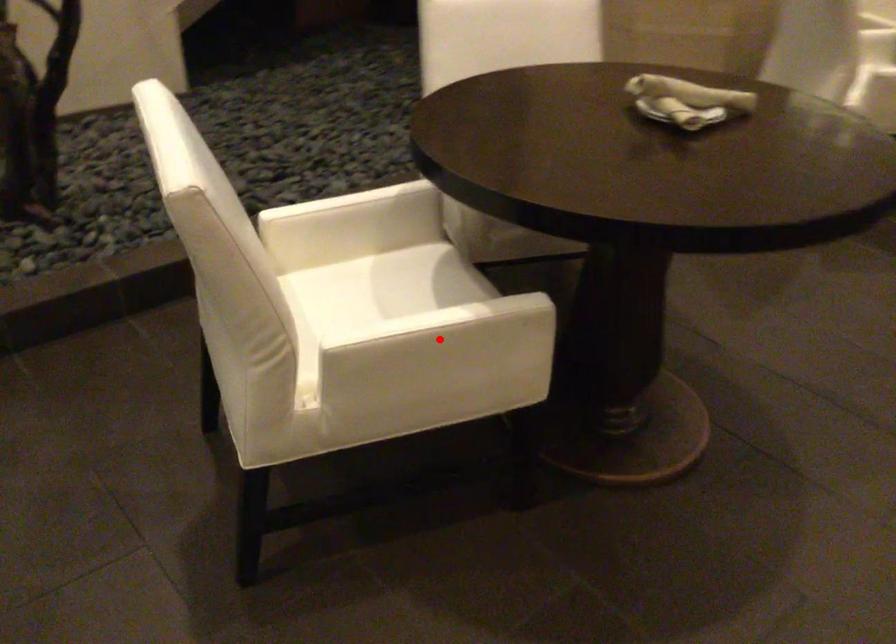
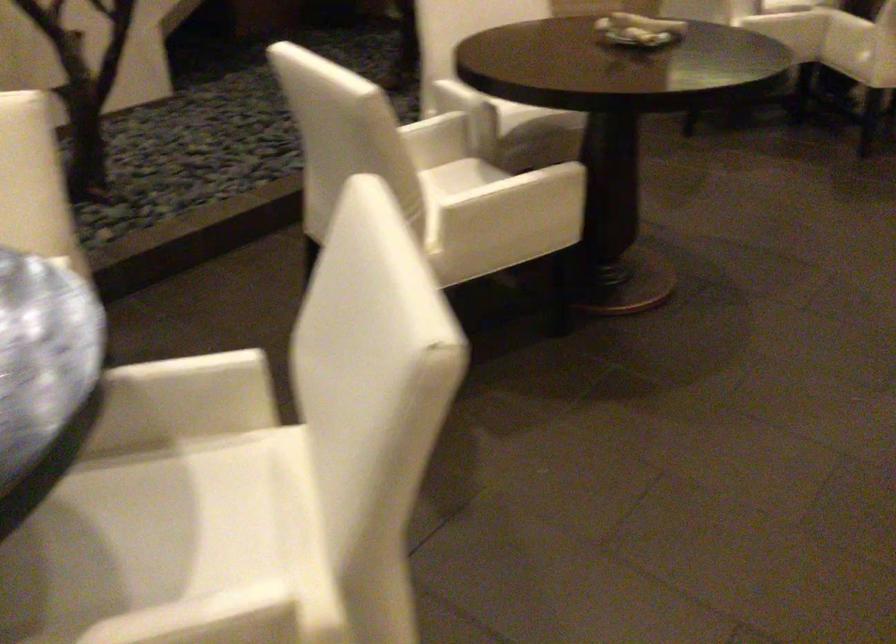
Question: I am providing you with two images of the same scene from different viewpoints. Given a red point in image1, look at the same physical point in image2. Is it:

Choices:
 (A) Closer to the viewpoint
 (B) Farther from the viewpoint

Answer: (B)